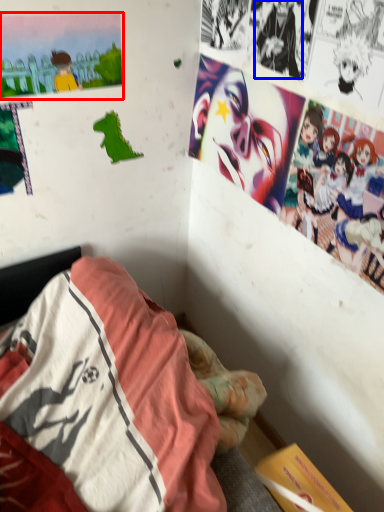
Question: Which point is closer to the camera, poster page (highlighted by a red box) or person (highlighted by a blue box)?

Choices:
 (A) poster page
 (B) person

Answer: (B)